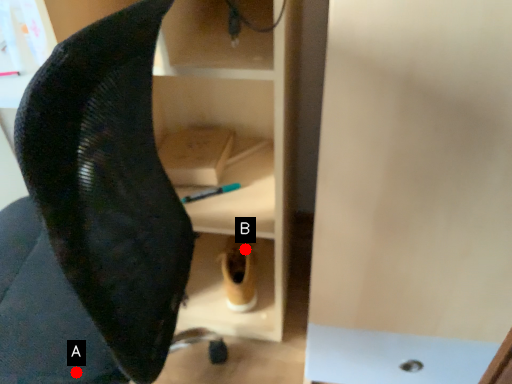
Question: Two points are circled on the image, labeled by A and B beside each circle. Which of the following is the farthest from the observer?

Choices:
 (A) A is further
 (B) B is further

Answer: (B)